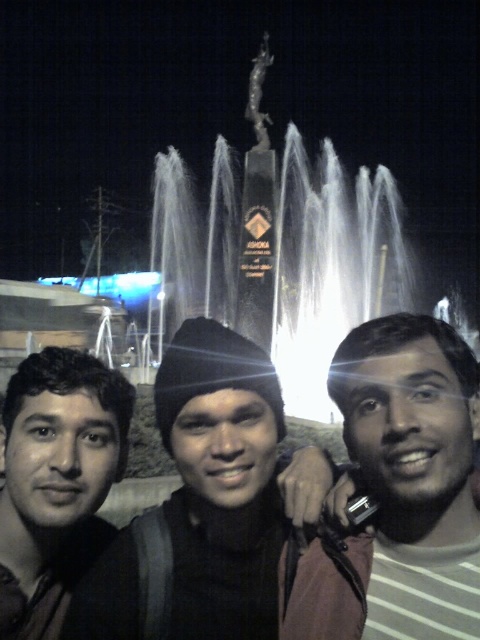
Question: From the image, what is the correct spatial relationship of dark knit cap at center in relation to matte black face at left?

Choices:
 (A) above
 (B) below

Answer: (A)

Question: Is the position of dark knit cap at center more distant than that of smooth black jacket at center?

Choices:
 (A) no
 (B) yes

Answer: (B)

Question: Among these objects, which one is farthest from the camera?

Choices:
 (A) silver metallic statue at upper center
 (B) smooth black jacket at center
 (C) matte black face at left

Answer: (A)

Question: Which of the following is the farthest from the observer?

Choices:
 (A) (395, 353)
 (B) (252, 80)
 (C) (8, 449)
 (D) (340, 598)

Answer: (B)

Question: Considering the real-world distances, which object is closest to the dark knit cap at center?

Choices:
 (A) silver metallic statue at upper center
 (B) matte black face at left
 (C) smooth black jacket at center

Answer: (C)

Question: Is smooth black jacket at center to the right of matte black face at left from the viewer's perspective?

Choices:
 (A) no
 (B) yes

Answer: (B)